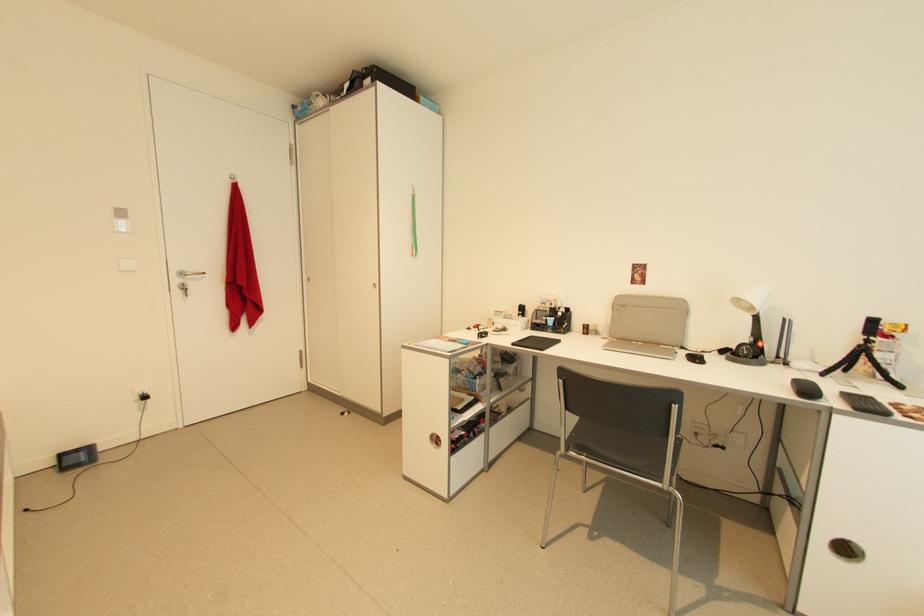
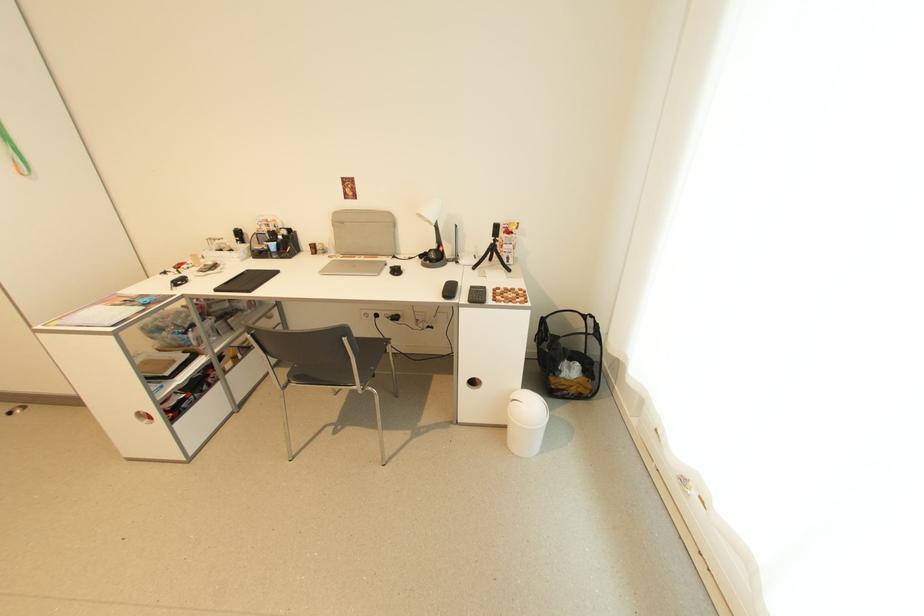
Find the pixel in the second image that matches point 629,308 in the first image.

(347, 224)